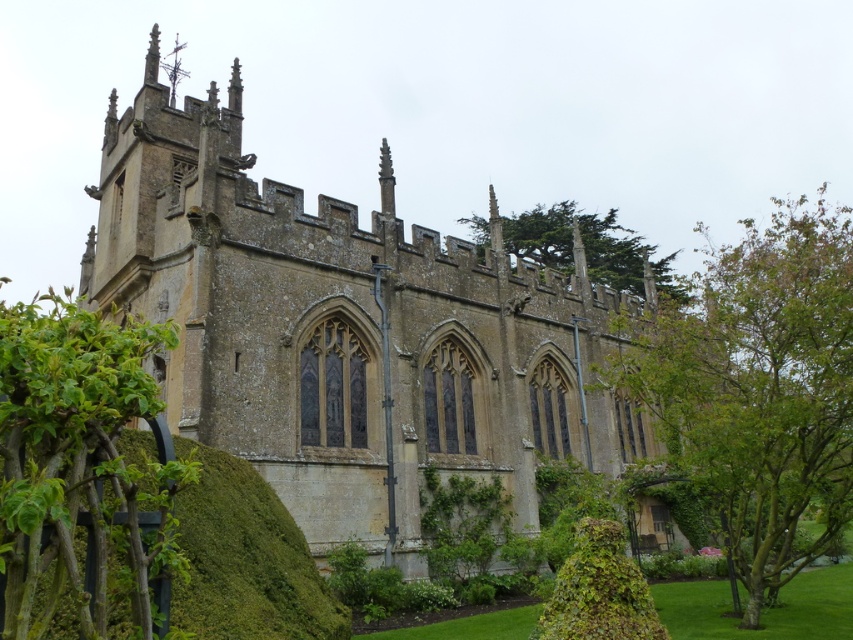
Question: From the image, what is the correct spatial relationship of green mossy hedge at lower left in relation to green leafy tree at upper center?

Choices:
 (A) below
 (B) above

Answer: (A)

Question: Can you confirm if green leafy tree at right is thinner than green mossy hedge at lower left?

Choices:
 (A) no
 (B) yes

Answer: (A)

Question: Which is farther from the green mossy hedge at lower left?

Choices:
 (A) green leafy bush at lower left
 (B) green leafy tree at upper center
 (C) yellow stone church at center
 (D) green leafy hedge at lower center

Answer: (B)

Question: Which point appears farthest from the camera in this image?

Choices:
 (A) (64, 532)
 (B) (297, 586)

Answer: (B)

Question: Among these objects, which one is farthest from the camera?

Choices:
 (A) green leafy tree at upper center
 (B) green leafy hedge at lower center
 (C) yellow stone church at center
 (D) green leafy tree at right

Answer: (A)

Question: Is yellow stone church at center further to camera compared to green leafy hedge at lower center?

Choices:
 (A) no
 (B) yes

Answer: (B)